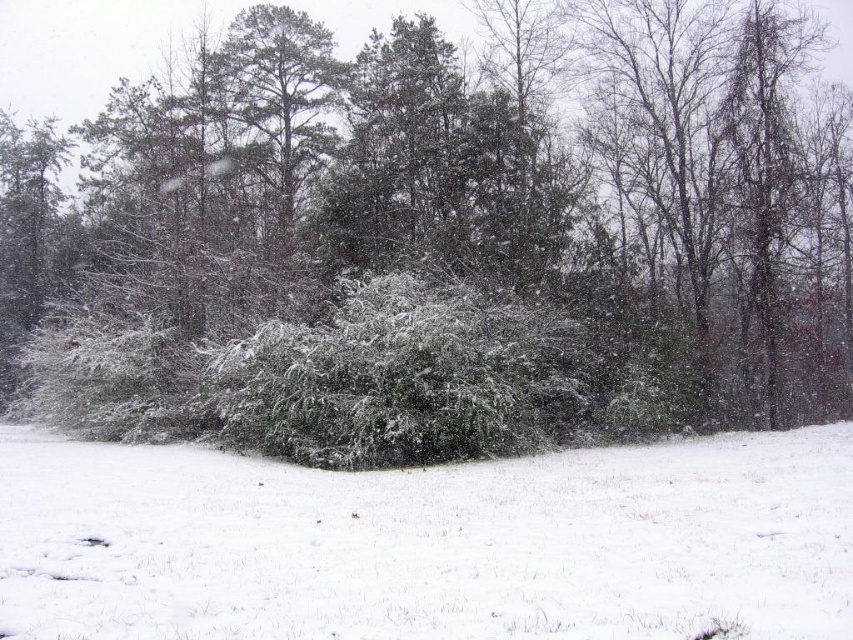
Question: Among these objects, which one is farthest from the camera?

Choices:
 (A) green matte bush at center
 (B) white fluffy snow at center

Answer: (A)

Question: Does green matte bush at center appear on the right side of white fluffy snow at center?

Choices:
 (A) no
 (B) yes

Answer: (A)

Question: Does green matte bush at center appear on the right side of white fluffy snow at center?

Choices:
 (A) yes
 (B) no

Answer: (B)

Question: Which point appears farthest from the camera in this image?

Choices:
 (A) (490, 577)
 (B) (776, 348)

Answer: (B)

Question: Does green matte bush at center have a lesser width compared to white fluffy snow at center?

Choices:
 (A) yes
 (B) no

Answer: (B)